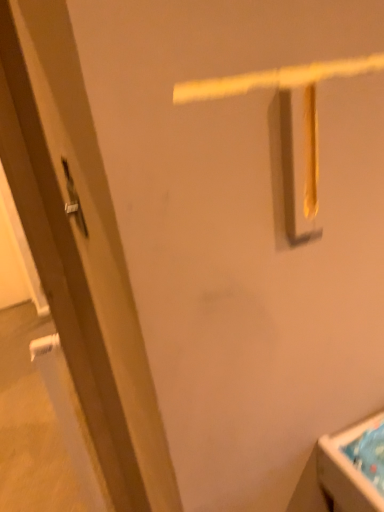
Question: Is white glossy sink at lower right taller or shorter than matte brown door at left?

Choices:
 (A) short
 (B) tall

Answer: (A)

Question: From a real-world perspective, is white glossy sink at lower right above or below matte brown door at left?

Choices:
 (A) below
 (B) above

Answer: (A)

Question: Which of these objects is positioned closest to the satin silver door handle at left?

Choices:
 (A) white glossy sink at lower right
 (B) matte brown door at left

Answer: (B)

Question: Which of these objects is positioned farthest from the satin silver door handle at left?

Choices:
 (A) matte brown door at left
 (B) white glossy sink at lower right

Answer: (B)